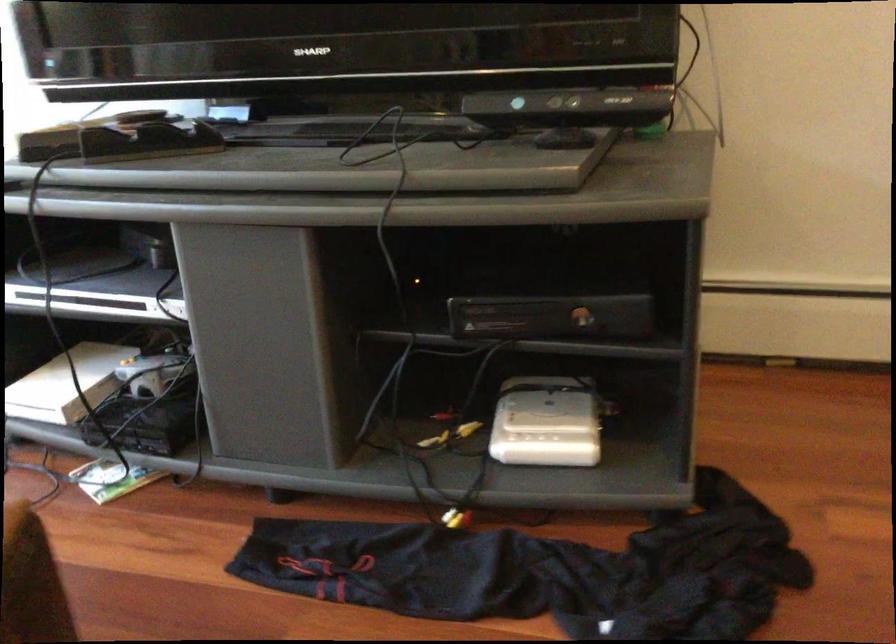
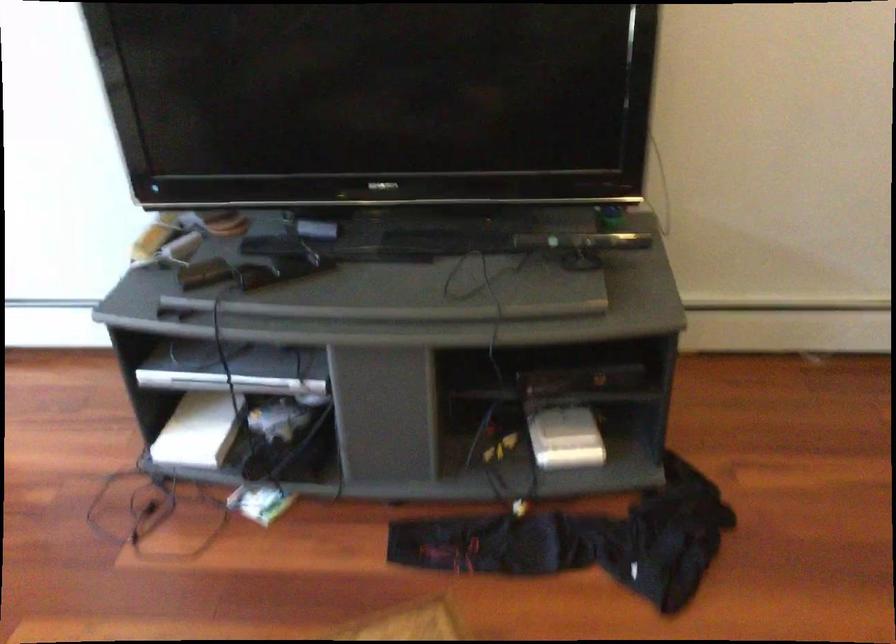
Locate, in the second image, the point that corresponds to (569,108) in the first image.

(582, 241)